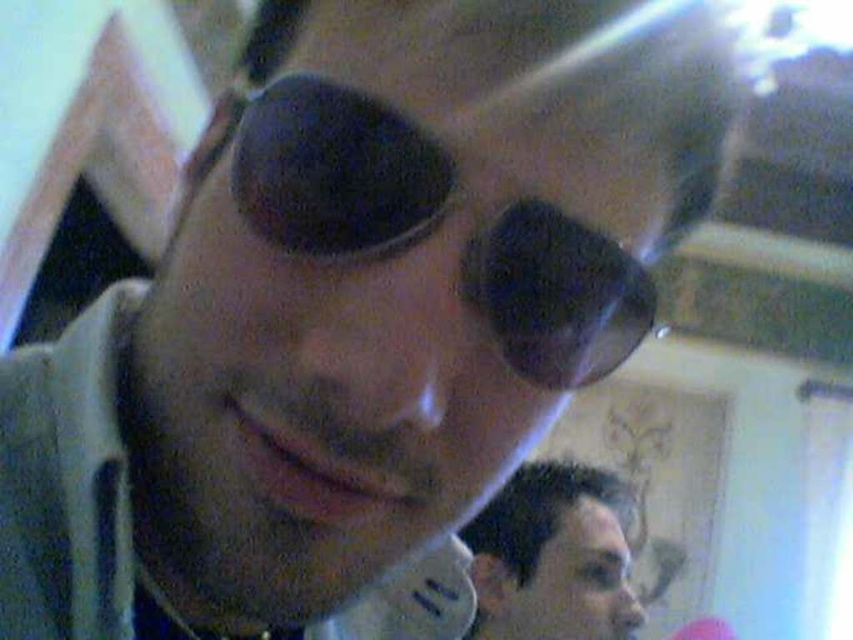
You are a photographer setting up a portrait session. You notice the black rubber goggles at center and the dark brown hair at lower right in the frame. Which object is positioned closer to the bottom edge of the image?

The dark brown hair at lower right is closer to the bottom edge of the image because it is located at the lower right, while the black rubber goggles at center are positioned centrally.

You are a photographer trying to adjust the lighting for a portrait. You notice the black rubber goggles at center and the dark brown hair at lower right in your frame. Which object is positioned more to the left?

The black rubber goggles at center is positioned more to the left than the dark brown hair at lower right.

You are a photographer trying to adjust the focus of your camera. The camera is currently focused on the point at coordinates point (376,216). If the distance between the camera and this point is 25.79 centimeters, what is the minimum distance you need to move the focus ring to achieve sharp focus on an object 30 centimeters away?

The minimum distance you need to move the focus ring is the difference between the current distance and the desired distance. Since the camera is currently focused at 25.79 centimeters and you want to focus on an object 30 centimeters away, you need to move the focus ring to adjust the distance by 30 cm minus 25.79 cm, resulting in a required adjustment of 4.21 centimeters.